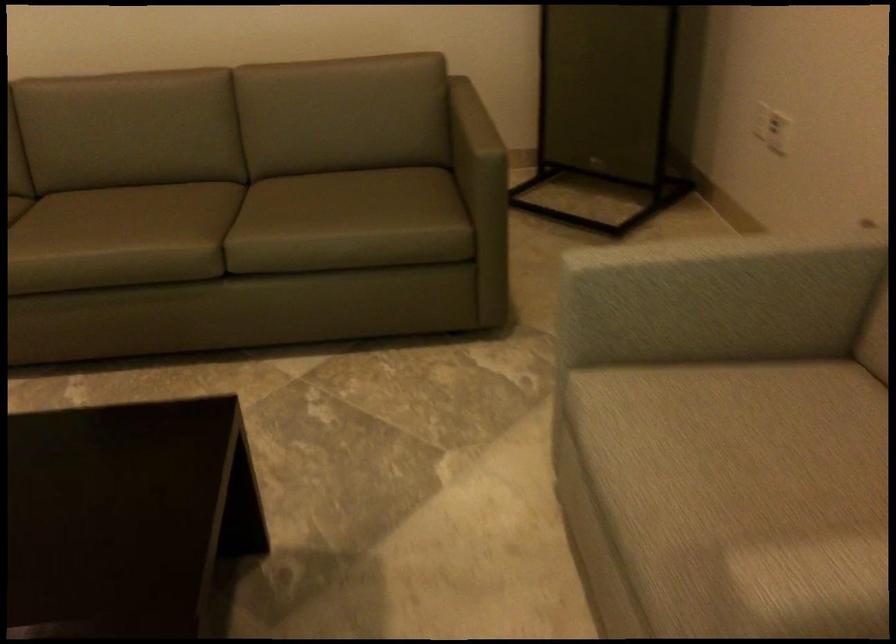
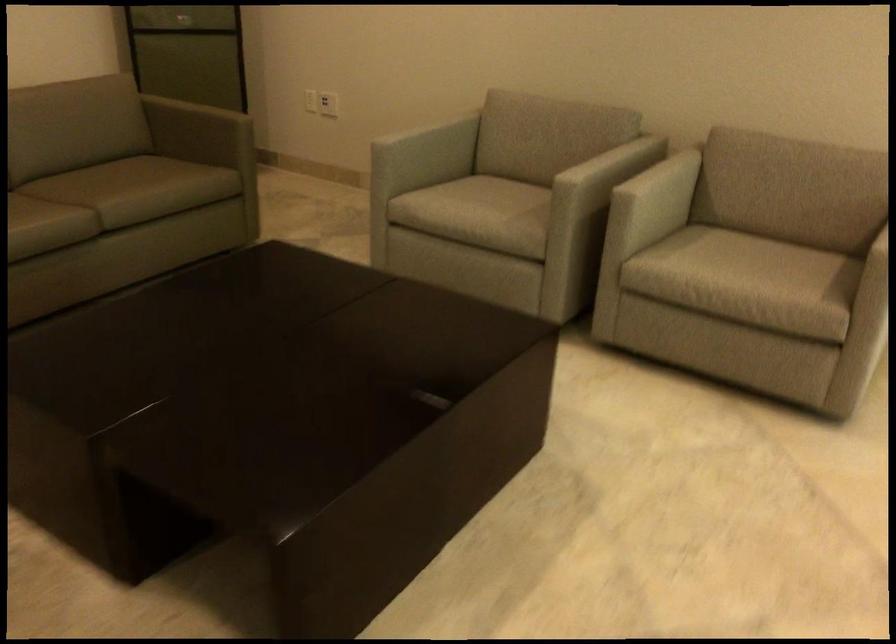
Find the pixel in the second image that matches the point at 718,495 in the first image.

(480, 207)